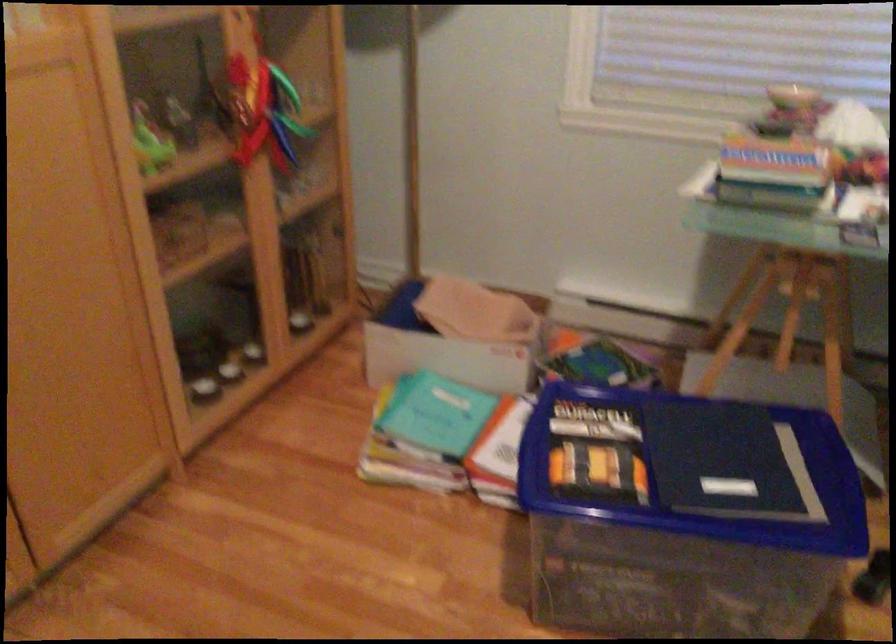
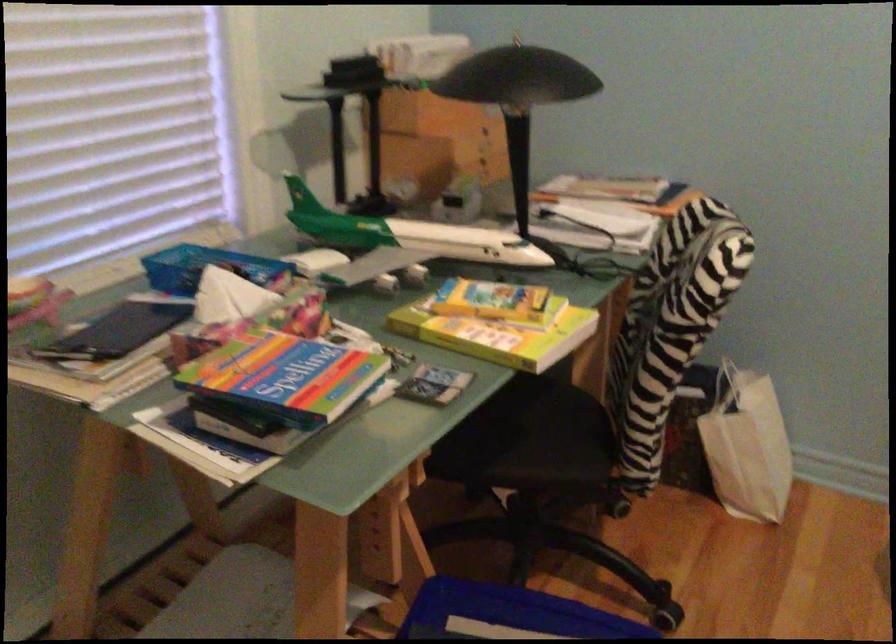
Locate, in the second image, the point that corresponds to (x=776, y=156) in the first image.

(285, 377)